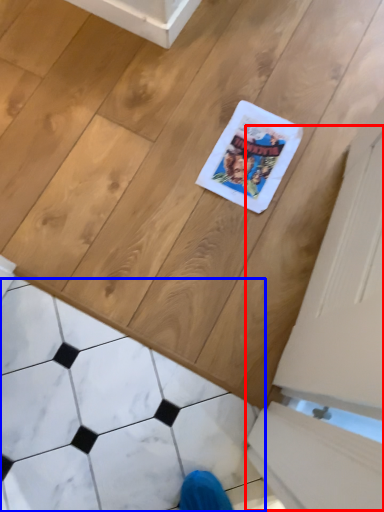
Question: Which of the following is the farthest to the observer, screen door (highlighted by a red box) or marble (highlighted by a blue box)?

Choices:
 (A) screen door
 (B) marble

Answer: (A)